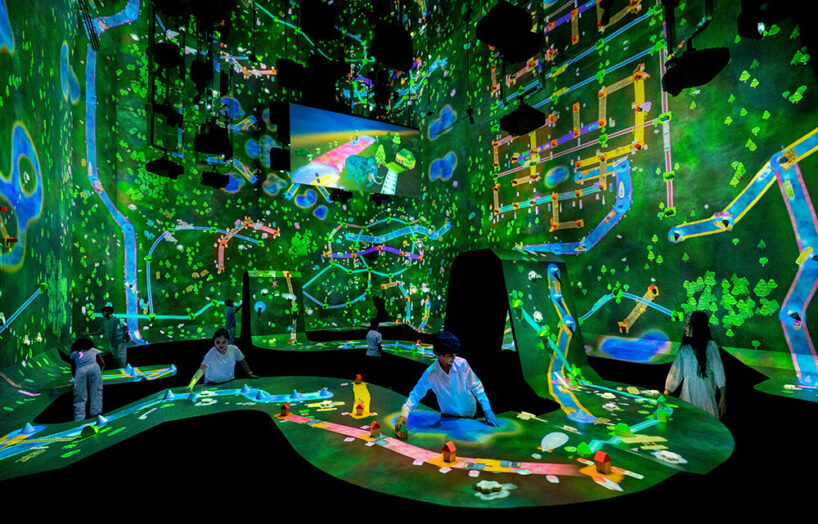
This screenshot has width=818, height=524. Find the location of `decorated green wall`. decorated green wall is located at coordinates (765, 199), (313, 205), (151, 239).